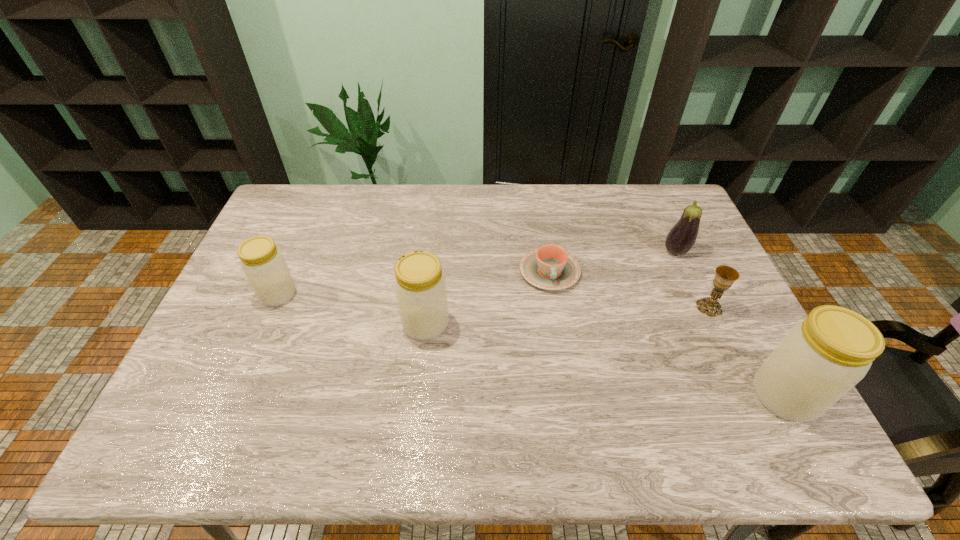
Where is `chalice located at the right edge`? The image size is (960, 540). chalice located at the right edge is located at coordinates (725, 276).

I want to click on object that is at the near right corner, so click(820, 359).

I want to click on free space at the far edge, so click(521, 214).

Where is `vacant space at the near edge of the desktop`? vacant space at the near edge of the desktop is located at coordinates (458, 408).

In the image, there is a desktop. Identify the location of vacant area at the left edge. The height and width of the screenshot is (540, 960). coord(292,268).

Image resolution: width=960 pixels, height=540 pixels. In order to click on vacant space at the right edge in this screenshot , I will do `click(725, 331)`.

Locate an element on the screen. Image resolution: width=960 pixels, height=540 pixels. free space at the far left corner is located at coordinates (300, 195).

In the image, there is a desktop. Where is `free space at the far right corner`? The height and width of the screenshot is (540, 960). free space at the far right corner is located at coordinates (682, 210).

Where is `unoccupied area between the chalice and the eggplant`? The height and width of the screenshot is (540, 960). unoccupied area between the chalice and the eggplant is located at coordinates (692, 279).

What are the coordinates of `free space that is in between the chalice and the chinaware` in the screenshot? It's located at (630, 289).